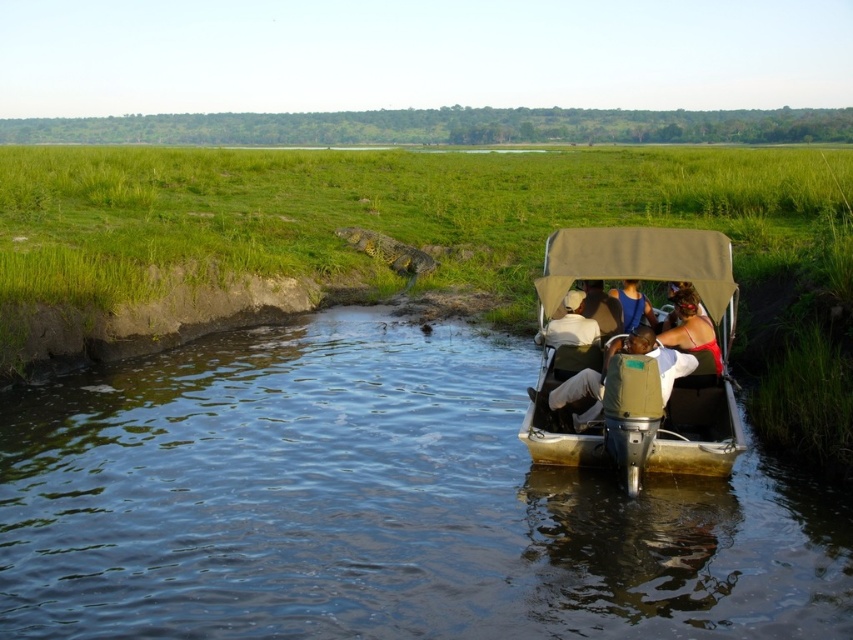
Question: Which object is the farthest from the red fabric person at center?

Choices:
 (A) light brown fabric hat at center
 (B) blue fabric shirt at center
 (C) clear water at lower center

Answer: (C)

Question: Among these objects, which one is farthest from the camera?

Choices:
 (A) red fabric person at center
 (B) green canvas boat at center
 (C) light brown fabric hat at center
 (D) clear water at lower center

Answer: (C)

Question: Does clear water at lower center appear under light brown fabric hat at center?

Choices:
 (A) yes
 (B) no

Answer: (A)

Question: Considering the relative positions of clear water at lower center and light brown fabric hat at center in the image provided, where is clear water at lower center located with respect to light brown fabric hat at center?

Choices:
 (A) right
 (B) left

Answer: (B)

Question: Is clear water at lower center to the left of blue fabric shirt at center from the viewer's perspective?

Choices:
 (A) yes
 (B) no

Answer: (A)

Question: Among these objects, which one is nearest to the camera?

Choices:
 (A) red fabric person at center
 (B) clear water at lower center

Answer: (B)